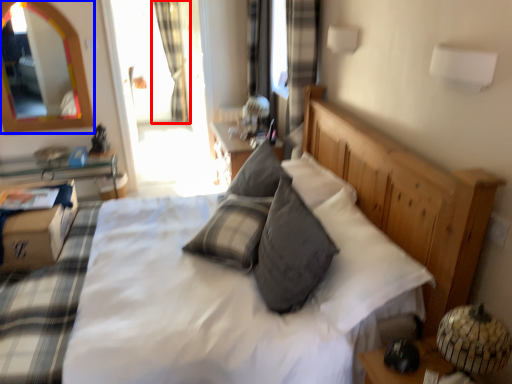
Question: Which object is closer to the camera taking this photo, curtain (highlighted by a red box) or mirror (highlighted by a blue box)?

Choices:
 (A) curtain
 (B) mirror

Answer: (B)